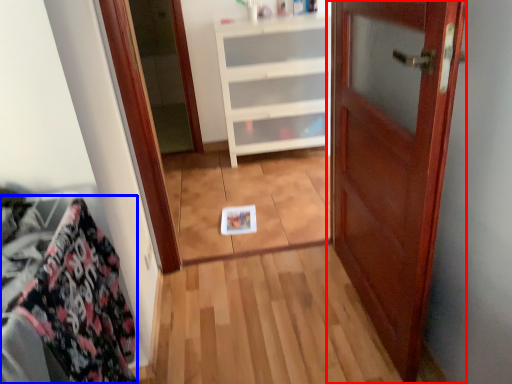
Question: Which point is further to the camera, door (highlighted by a red box) or material (highlighted by a blue box)?

Choices:
 (A) door
 (B) material

Answer: (A)